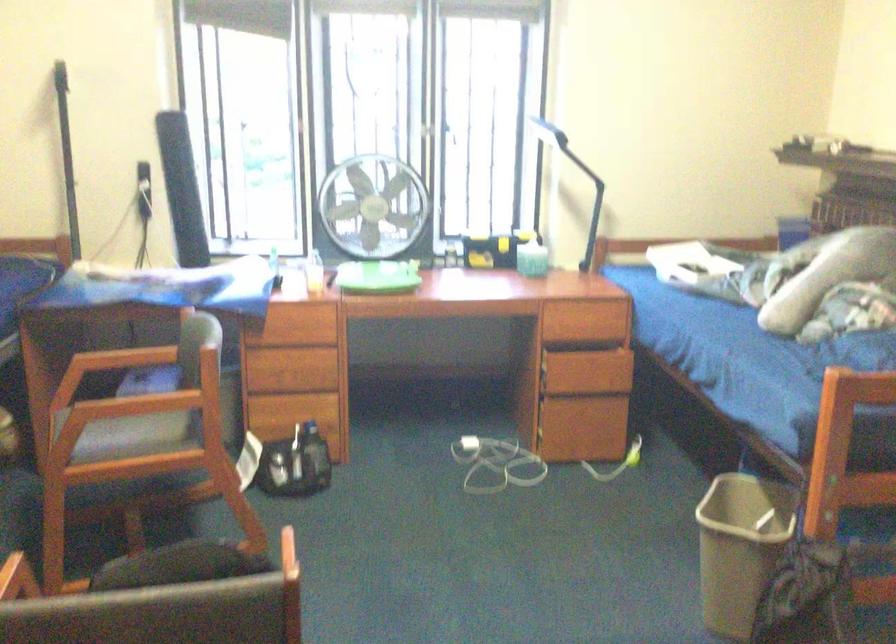
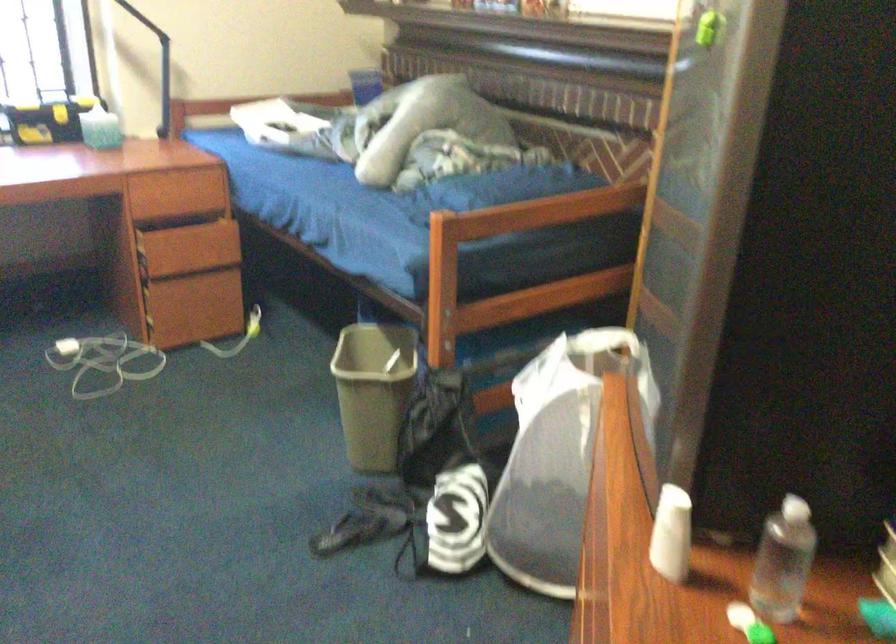
Question: The camera is either moving clockwise (left) or counter-clockwise (right) around the object. The first image is from the beginning of the video and the second image is from the end. Is the camera moving left or right when shooting the video?

Choices:
 (A) Left
 (B) Right

Answer: (A)